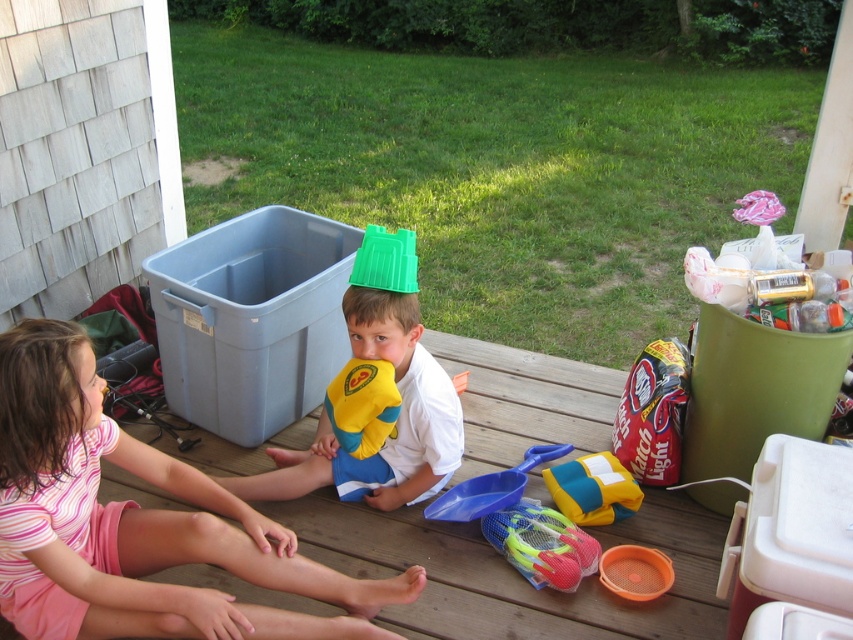
How much distance is there between green plastic bucket at center and yellow fabric beach ball at center?

green plastic bucket at center and yellow fabric beach ball at center are 18.76 inches apart from each other.

Can you confirm if green plastic bucket at center is thinner than yellow fabric beach ball at center?

In fact, green plastic bucket at center might be wider than yellow fabric beach ball at center.

Is point (412, 349) positioned in front of point (564, 499)?

Yes, point (412, 349) is closer to viewer.

Locate an element on the screen. Image resolution: width=853 pixels, height=640 pixels. green plastic bucket at center is located at coordinates (398, 390).

Based on the photo, can you confirm if green plastic bucket at center is positioned to the right of blue plastic shovel at center?

No, green plastic bucket at center is not to the right of blue plastic shovel at center.

Describe the element at coordinates (398, 390) in the screenshot. I see `green plastic bucket at center` at that location.

The width and height of the screenshot is (853, 640). Identify the location of green plastic bucket at center. (398, 390).

Does point (538, 509) come farther from viewer compared to point (569, 493)?

No, (538, 509) is in front of (569, 493).

Does neon green plastic bucket at lower center come behind yellow fabric beach ball at center?

No, it is not.

Describe the element at coordinates (541, 545) in the screenshot. I see `neon green plastic bucket at lower center` at that location.

Locate an element on the screen. This screenshot has width=853, height=640. neon green plastic bucket at lower center is located at coordinates (541, 545).